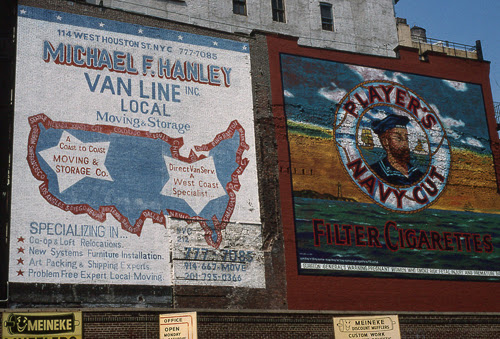
Where is `white bottom strip`? The width and height of the screenshot is (500, 339). white bottom strip is located at coordinates (449, 273).